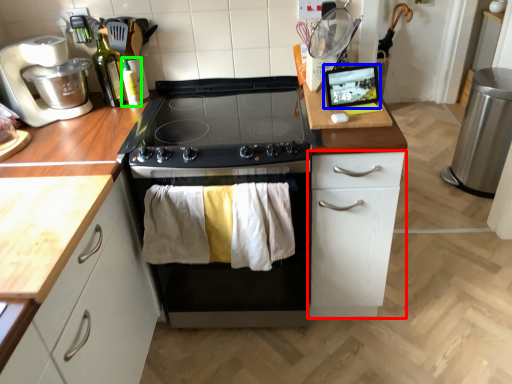
Question: Estimate the real-world distances between objects in this image. Which object is closer to cabinetry (highlighted by a red box), appliance (highlighted by a blue box) or bottle (highlighted by a green box)?

Choices:
 (A) appliance
 (B) bottle

Answer: (A)